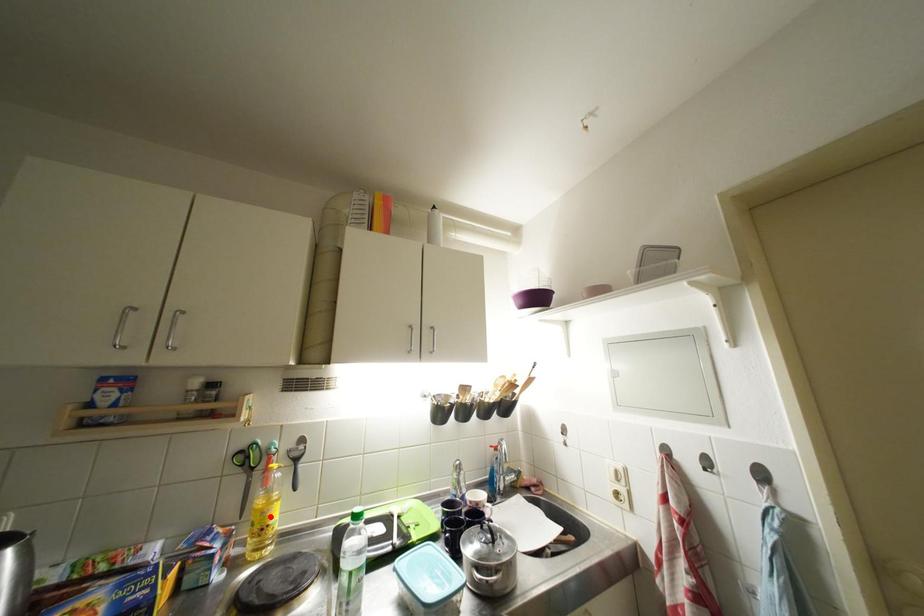
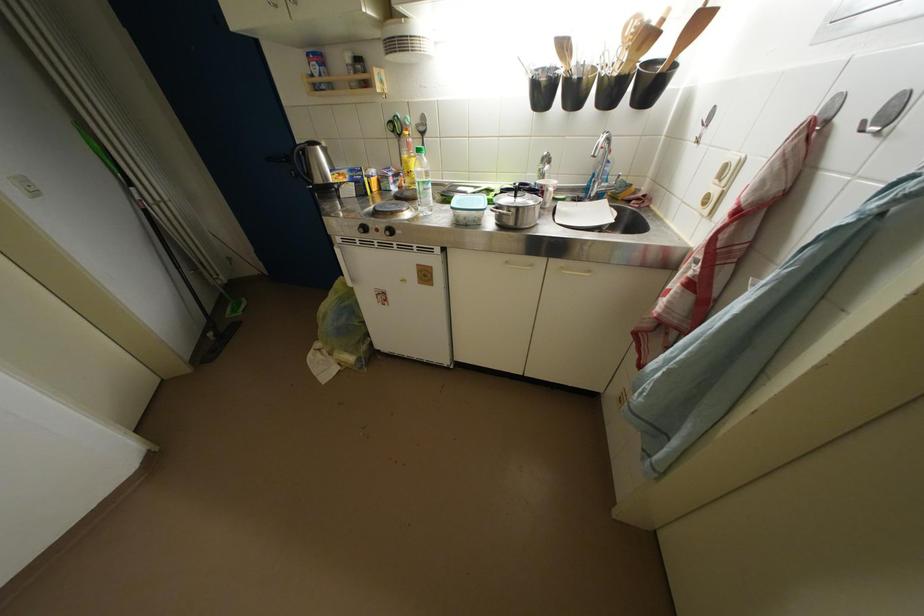
Question: I am providing you with two images of the same scene from different viewpoints. A red point is marked on the first image. At the location where the point appears in image 1, is it still visible in image 2?

Choices:
 (A) Yes
 (B) No

Answer: (A)